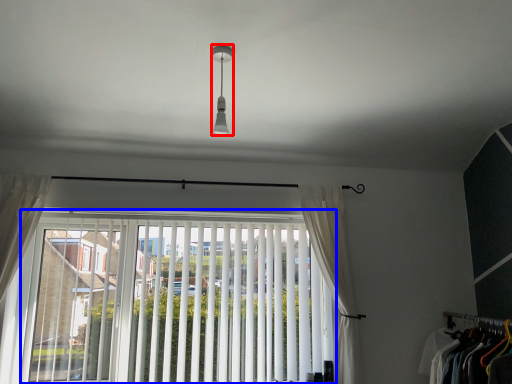
Question: Which point is closer to the camera, light fixture (highlighted by a red box) or window (highlighted by a blue box)?

Choices:
 (A) light fixture
 (B) window

Answer: (A)